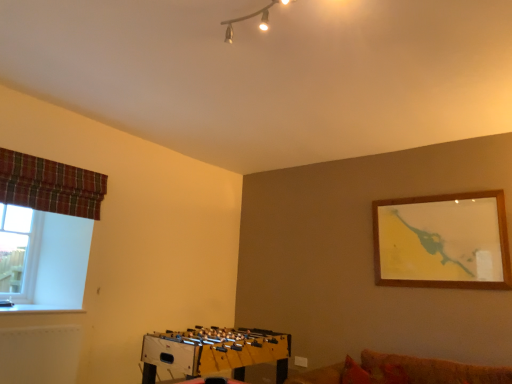
Question: In terms of height, does metallic track lighting at upper center look taller or shorter compared to plaid fabric curtain at left?

Choices:
 (A) tall
 (B) short

Answer: (B)

Question: In the image, is metallic track lighting at upper center positioned in front of or behind plaid fabric curtain at left?

Choices:
 (A) front
 (B) behind

Answer: (A)

Question: Estimate the real-world distances between objects in this image. Which object is farther from the plaid fabric curtain at left?

Choices:
 (A) wooden foosball table at lower center
 (B) metallic track lighting at upper center
 (C) clear glass window at left

Answer: (B)

Question: Estimate the real-world distances between objects in this image. Which object is farther from the metallic track lighting at upper center?

Choices:
 (A) clear glass window at left
 (B) wooden foosball table at lower center
 (C) plaid fabric curtain at left

Answer: (A)